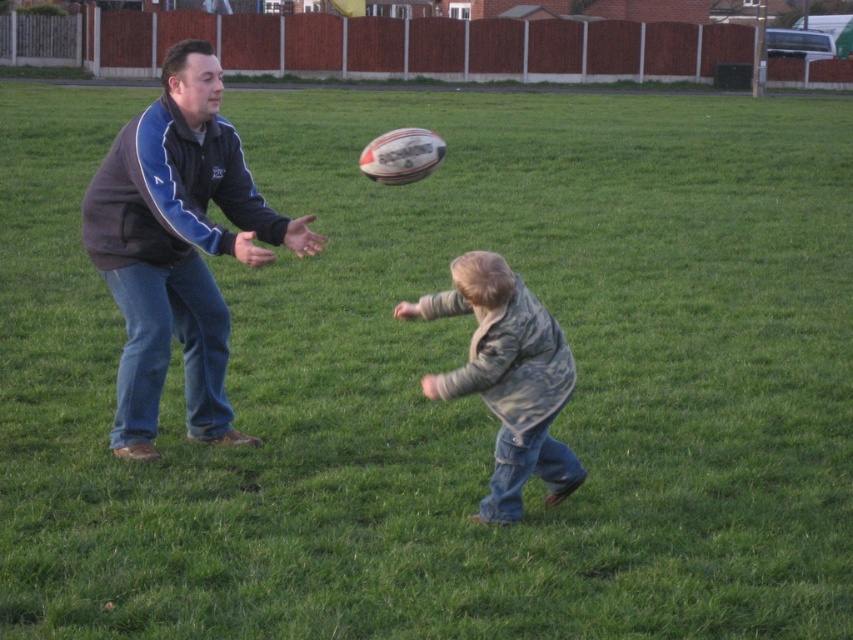
From the picture: You are standing in the park and see the dark blue fleece jacket at left and the denim jacket at lower center. Which jacket is closer to you?

The dark blue fleece jacket at left is closer to you because it is positioned further to the viewer than the denim jacket at lower center.

You are a delivery person who needs to place a package that is 1.2 meters long between the dark blue fleece jacket at left and the denim jacket at lower center. Can the package fit between them without overlapping either jacket?

The distance between the dark blue fleece jacket at left and the denim jacket at lower center is 1.18 meters. Since the package is 1.2 meters long, it is slightly longer than the available space. Therefore, the package cannot fit between them without overlapping either jacket.

You are trying to decide which jacket to take for a walk. The dark blue fleece jacket at left is above the denim jacket at lower center. Which jacket is higher in the image?

The dark blue fleece jacket at left is higher in the image because it is positioned above the denim jacket at lower center.